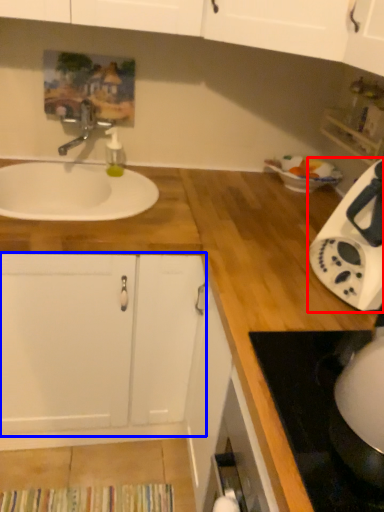
Question: Which of the following is the farthest to the observer, home appliance (highlighted by a red box) or cabinetry (highlighted by a blue box)?

Choices:
 (A) home appliance
 (B) cabinetry

Answer: (B)